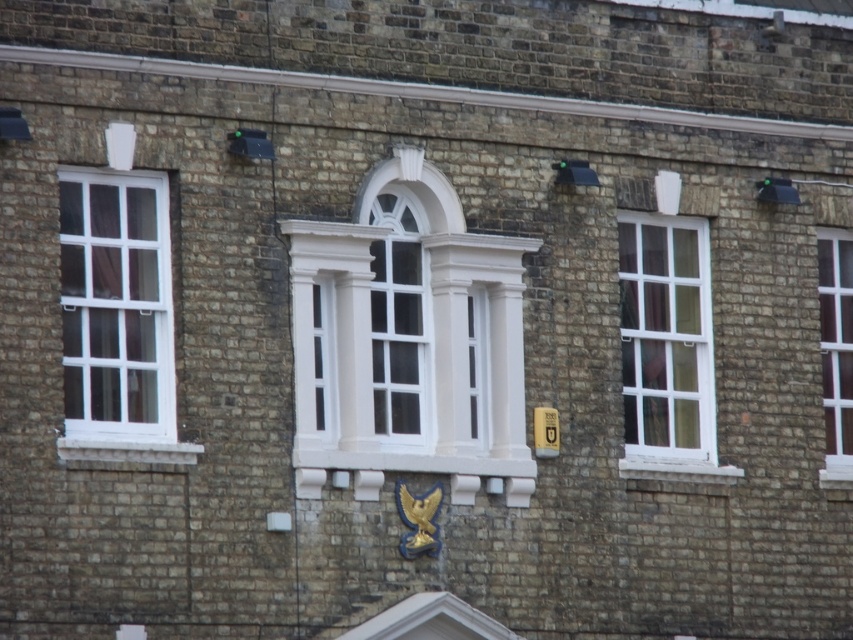
Is white plastic window at left closer to the viewer compared to white wooden window at center?

Yes, white plastic window at left is in front of white wooden window at center.

The height and width of the screenshot is (640, 853). Describe the element at coordinates (115, 305) in the screenshot. I see `white plastic window at left` at that location.

The width and height of the screenshot is (853, 640). What are the coordinates of `white plastic window at left` in the screenshot? It's located at (115, 305).

Based on the photo, does white glossy window at center have a lesser width compared to white plastic window at left?

Correct, white glossy window at center's width is less than white plastic window at left's.

Is point (427, 273) behind point (126, 372)?

Yes.

I want to click on white glossy window at center, so click(407, 340).

Between white plastic window at left and white glass window at right, which one is positioned higher?

white plastic window at left is above.

Does white plastic window at left appear over white glass window at right?

Indeed, white plastic window at left is positioned over white glass window at right.

This screenshot has width=853, height=640. What are the coordinates of `white plastic window at left` in the screenshot? It's located at (115, 305).